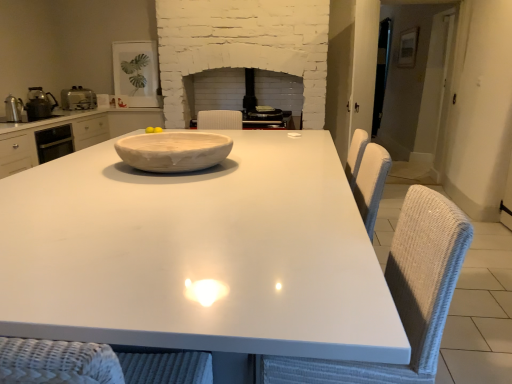
Question: Considering the positions of metallic silver kettle at left, the 3th appliance when ordered from back to front, and satin silver toaster at left, which is counted as the 2th appliance, starting from the back, in the image, is metallic silver kettle at left, the 3th appliance when ordered from back to front, taller or shorter than satin silver toaster at left, which is counted as the 2th appliance, starting from the back,?

Choices:
 (A) tall
 (B) short

Answer: (A)

Question: Looking at their shapes, would you say metallic silver kettle at left, the 3th appliance when ordered from back to front, is wider or thinner than satin silver toaster at left, placed as the third appliance when sorted from front to back?

Choices:
 (A) thin
 (B) wide

Answer: (A)

Question: Estimate the real-world distances between objects in this image. Which object is closer to the matte white picture frame at upper left, acting as the fourth appliance starting from the front?

Choices:
 (A) satin silver toaster at left, which is counted as the 2th appliance, starting from the back
 (B) white wicker swivel chair at right
 (C) yellow matte/yellowish smooth lemon at center
 (D) white matte bowl at center
 (E) white glossy table at center

Answer: (A)

Question: Considering the real-world distances, which object is farthest from the white matte bowl at center?

Choices:
 (A) yellow matte/yellowish smooth lemon at center
 (B) metallic silver kettle at left, the 3th appliance when ordered from back to front
 (C) satin silver toaster at left, placed as the third appliance when sorted from front to back
 (D) white wicker swivel chair at right
 (E) metallic silver kettle at left, the first appliance from the front

Answer: (C)